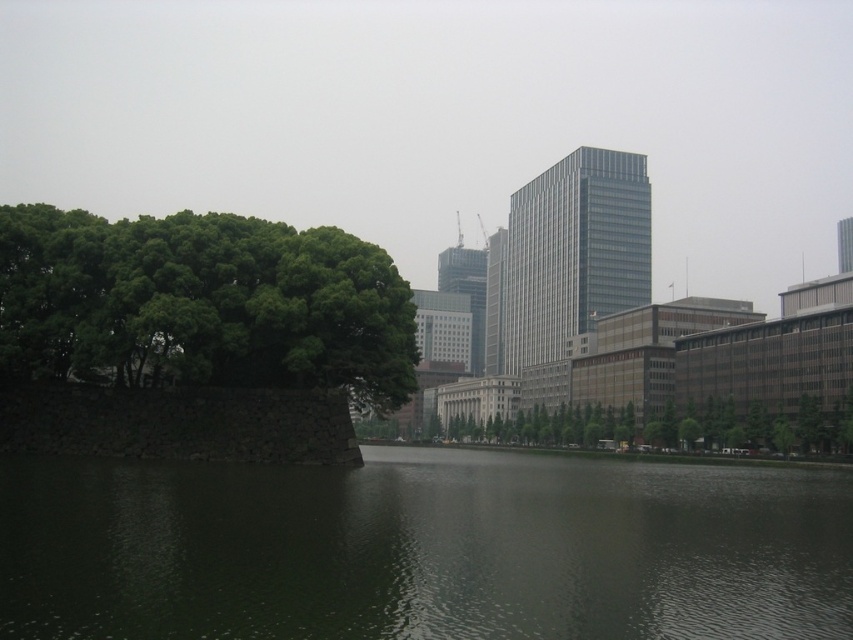
Between green water at center and green leafy tree at center, which one is positioned higher?

green water at center

Between point (737, 506) and point (717, 429), which one is positioned in front?

Positioned in front is point (737, 506).

What do you see at coordinates (422, 548) in the screenshot? The image size is (853, 640). I see `green water at center` at bounding box center [422, 548].

Where is `green water at center`? green water at center is located at coordinates [x=422, y=548].

At what (x,y) coordinates should I click in order to perform the action: click on green water at center. Please return your answer as a coordinate pair (x, y). This screenshot has width=853, height=640. Looking at the image, I should click on (422, 548).

Can you confirm if green water at center is positioned above green leafy tree at left?

Incorrect, green water at center is not positioned above green leafy tree at left.

Between point (643, 518) and point (125, 320), which one is positioned in front?

Positioned in front is point (643, 518).

Where is `green water at center`? Image resolution: width=853 pixels, height=640 pixels. green water at center is located at coordinates (422, 548).

Does green leafy tree at left have a greater height compared to green leafy tree at center?

In fact, green leafy tree at left may be shorter than green leafy tree at center.

The image size is (853, 640). Describe the element at coordinates (202, 304) in the screenshot. I see `green leafy tree at left` at that location.

What are the coordinates of `green leafy tree at left` in the screenshot? It's located at (202, 304).